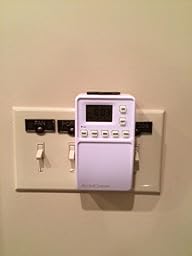
This screenshot has height=256, width=192. Find the location of `beige wall background empty space`. beige wall background empty space is located at coordinates (30, 228), (86, 227), (147, 228), (179, 162), (24, 81), (84, 63), (166, 82), (164, 33), (83, 27), (22, 27).